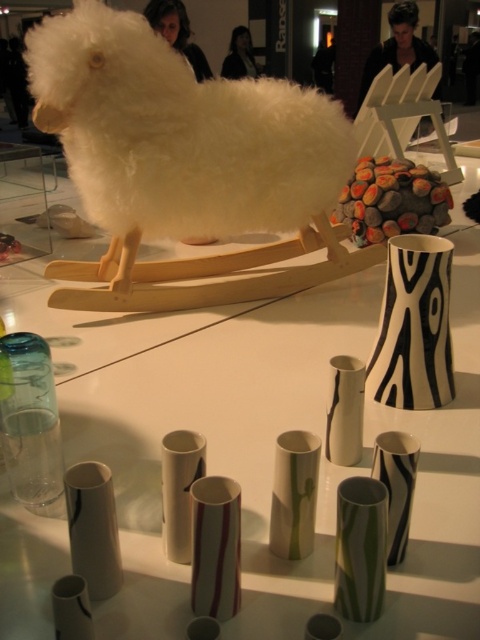
You are an art curator planning to install a new sculpture in the exhibition. The sculpture requires a clear space of at least 0.5 meters in diameter. Is the area around point (x=179, y=148) suitable for placing the sculpture?

The area around point (x=179, y=148) is occupied by a white fluffy sheep at center, so it is not suitable for placing the sculpture there.

You are an artist planning to place a new sculpture between the white fluffy sheep at center and the black and white striped vase at center right. Given their sizes, which object should the sculpture be placed closer to for balance?

The sculpture should be placed closer to the black and white striped vase at center right because the white fluffy sheep at center is larger, so balancing with a closer placement to the smaller object would create equilibrium.

You are a child who is 1.2 meters tall and standing in front of the display. You want to pet the white fluffy sheep at center. Can you reach it?

The white fluffy sheep at center is 1.12 meters away from the viewer. Since the child is 1.2 meters tall, they can likely reach it if they stretch out their arm, as the distance is slightly less than their height.